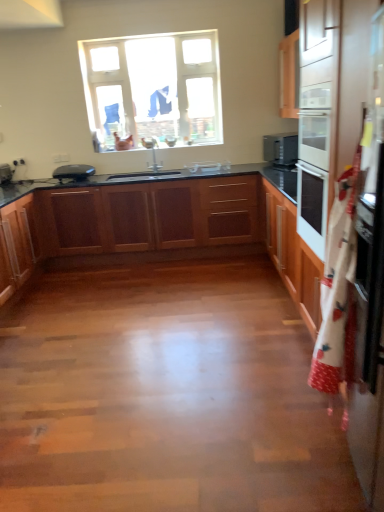
Question: Should I look upward or downward to see wooden cabinets at center, which is counted as the first cabinetry, starting from the front?

Choices:
 (A) down
 (B) up

Answer: (B)

Question: From a real-world perspective, is matte black toaster at left on satin black microwave at upper right?

Choices:
 (A) no
 (B) yes

Answer: (A)

Question: Considering the relative sizes of matte black toaster at left and satin black microwave at upper right in the image provided, is matte black toaster at left thinner than satin black microwave at upper right?

Choices:
 (A) no
 (B) yes

Answer: (B)

Question: Considering the relative sizes of matte black toaster at left and satin black microwave at upper right in the image provided, is matte black toaster at left shorter than satin black microwave at upper right?

Choices:
 (A) no
 (B) yes

Answer: (B)

Question: Is satin black microwave at upper right located within matte black toaster at left?

Choices:
 (A) no
 (B) yes

Answer: (A)

Question: Is matte black toaster at left at the left side of satin black microwave at upper right?

Choices:
 (A) yes
 (B) no

Answer: (A)

Question: Is matte black toaster at left turned away from satin black microwave at upper right?

Choices:
 (A) no
 (B) yes

Answer: (A)

Question: From the image's perspective, is wooden cabinet at left, which is counted as the second cabinetry, starting from the front, on top of clear glass window at upper center?

Choices:
 (A) no
 (B) yes

Answer: (A)

Question: Does wooden cabinet at left, placed as the second cabinetry when sorted from back to front, have a larger size compared to clear glass window at upper center?

Choices:
 (A) no
 (B) yes

Answer: (B)

Question: Can you confirm if wooden cabinet at left, which is counted as the second cabinetry, starting from the front, is wider than clear glass window at upper center?

Choices:
 (A) yes
 (B) no

Answer: (A)

Question: Is wooden cabinet at left, placed as the second cabinetry when sorted from back to front, positioned with its back to clear glass window at upper center?

Choices:
 (A) no
 (B) yes

Answer: (A)

Question: Considering the relative sizes of wooden cabinet at left, which is counted as the second cabinetry, starting from the front, and clear glass window at upper center in the image provided, is wooden cabinet at left, which is counted as the second cabinetry, starting from the front, thinner than clear glass window at upper center?

Choices:
 (A) no
 (B) yes

Answer: (A)

Question: Does wooden cabinet at left, placed as the second cabinetry when sorted from back to front, come in front of clear glass window at upper center?

Choices:
 (A) yes
 (B) no

Answer: (A)

Question: Does clear glass window at upper center have a lesser height compared to wooden cabinets at center, marked as the first cabinetry in a back-to-front arrangement?

Choices:
 (A) yes
 (B) no

Answer: (B)